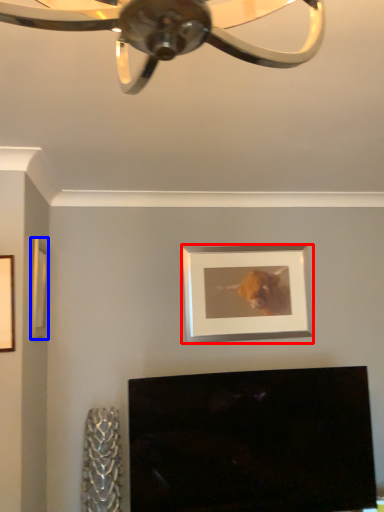
Question: Which object appears farthest to the camera in this image, picture frame (highlighted by a red box) or picture frame (highlighted by a blue box)?

Choices:
 (A) picture frame
 (B) picture frame

Answer: (A)